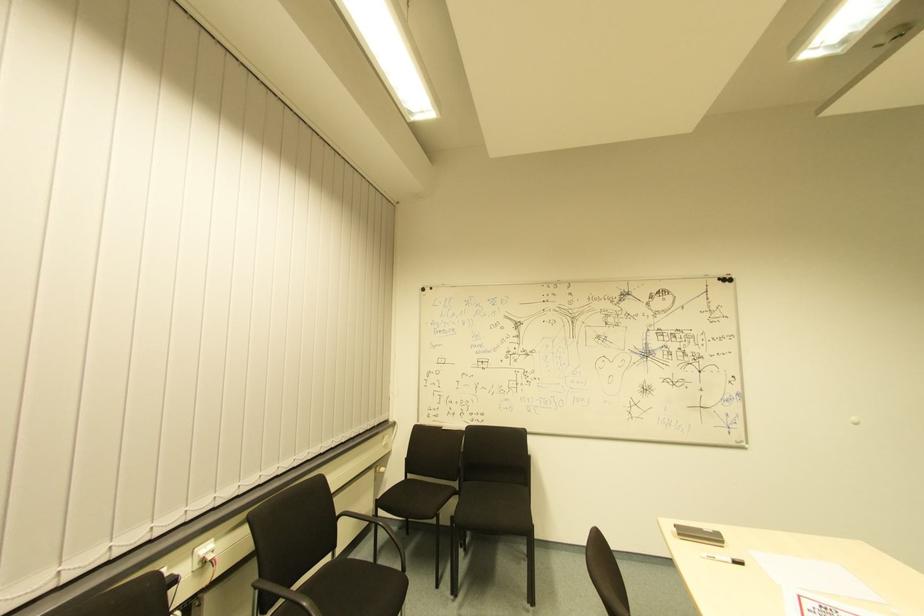
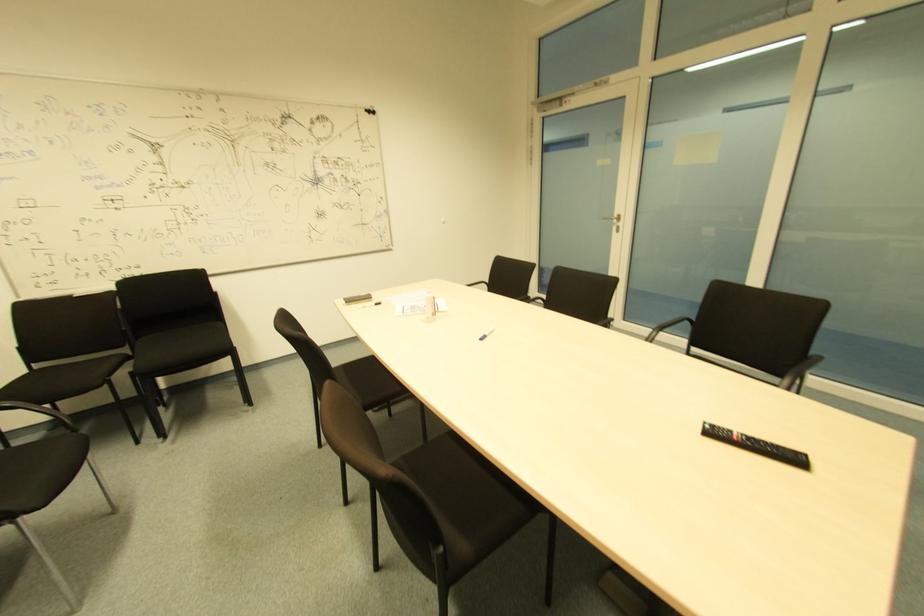
Find the pixel in the second image that matches point (713, 541) in the first image.

(365, 301)